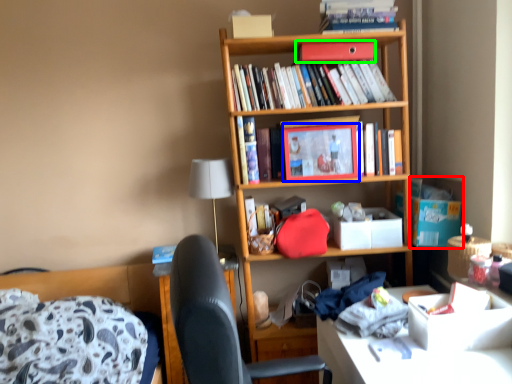
Question: Considering the real-world distances, which object is farthest from cardboard box (highlighted by a red box)? picture frame (highlighted by a blue box) or paperback book (highlighted by a green box)?

Choices:
 (A) picture frame
 (B) paperback book

Answer: (B)